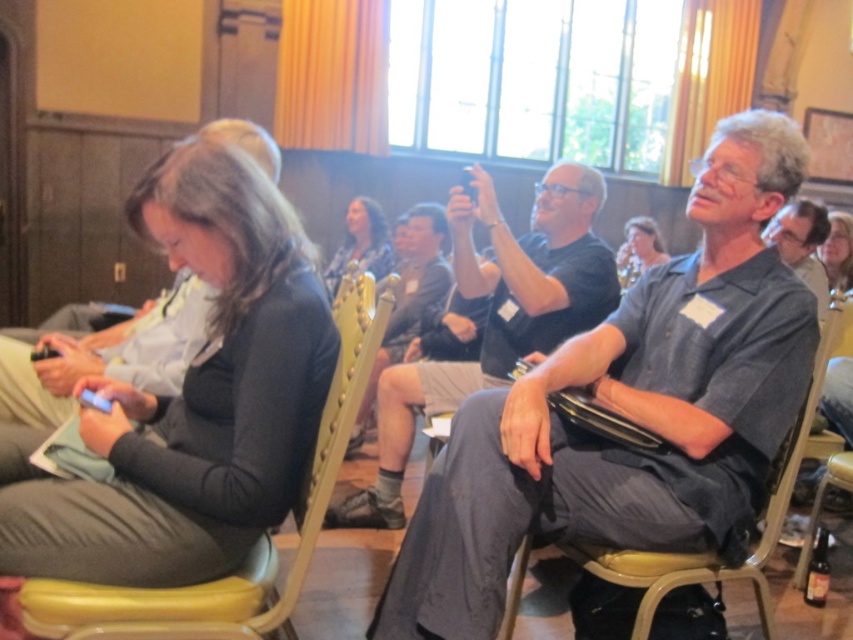
You are organizing a photo shoot and need to ensure that the gray fabric shirt at upper right and the matte black hair at upper center are both visible in the frame. Based on their positions, which object is closer to the camera?

The gray fabric shirt at upper right is closer to the camera because it is in front of the matte black hair at upper center.